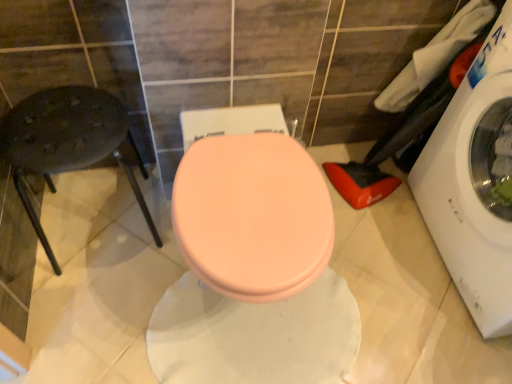
The image size is (512, 384). I want to click on free area below metallic black stool at left (from a real-world perspective), so click(101, 233).